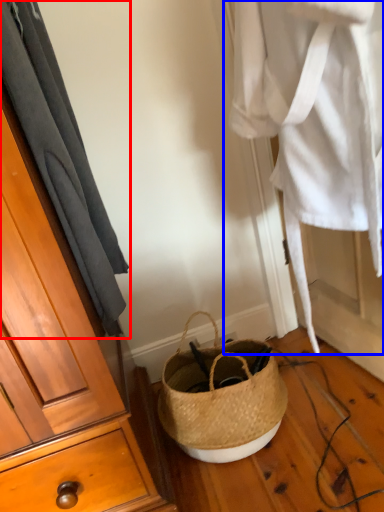
Question: Which object appears closest to the camera in this image, curtain (highlighted by a red box) or clothing (highlighted by a blue box)?

Choices:
 (A) curtain
 (B) clothing

Answer: (A)